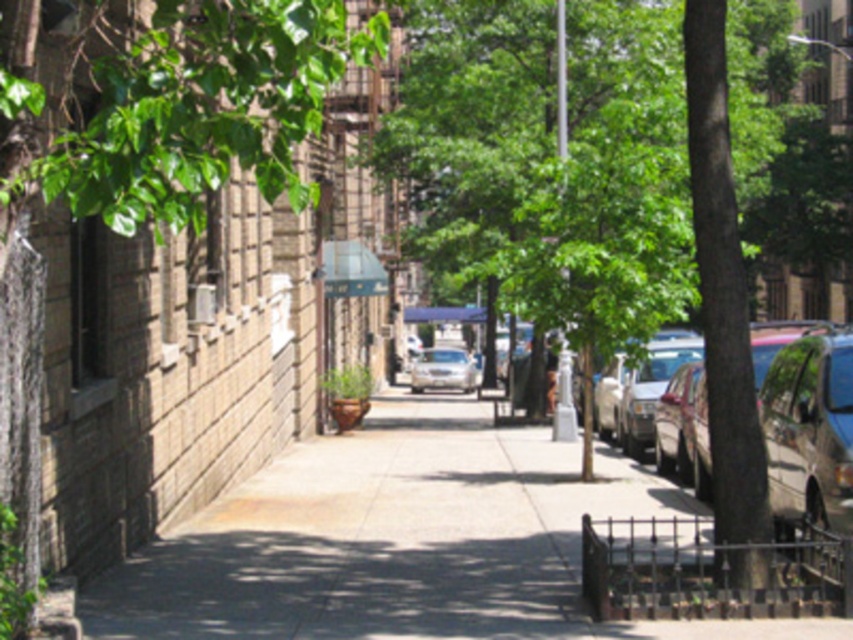
Question: Can you confirm if green leafy tree at left is smaller than satin silver sedan at center?

Choices:
 (A) no
 (B) yes

Answer: (B)

Question: Which point appears farthest from the camera in this image?

Choices:
 (A) (209, 38)
 (B) (775, 465)
 (C) (469, 365)

Answer: (C)

Question: Is the position of smooth concrete sidewalk at center more distant than that of green leafy tree at left?

Choices:
 (A) yes
 (B) no

Answer: (A)

Question: Which of the following is the closest to the observer?

Choices:
 (A) (450, 602)
 (B) (447, 378)
 (C) (25, 86)
 (D) (762, 371)

Answer: (C)

Question: Among these objects, which one is farthest from the camera?

Choices:
 (A) green leafy tree at left
 (B) smooth concrete sidewalk at center
 (C) metallic silver car at right
 (D) satin silver sedan at center

Answer: (D)

Question: Where is smooth concrete sidewalk at center located in relation to green leafy tree at left in the image?

Choices:
 (A) left
 (B) right

Answer: (B)